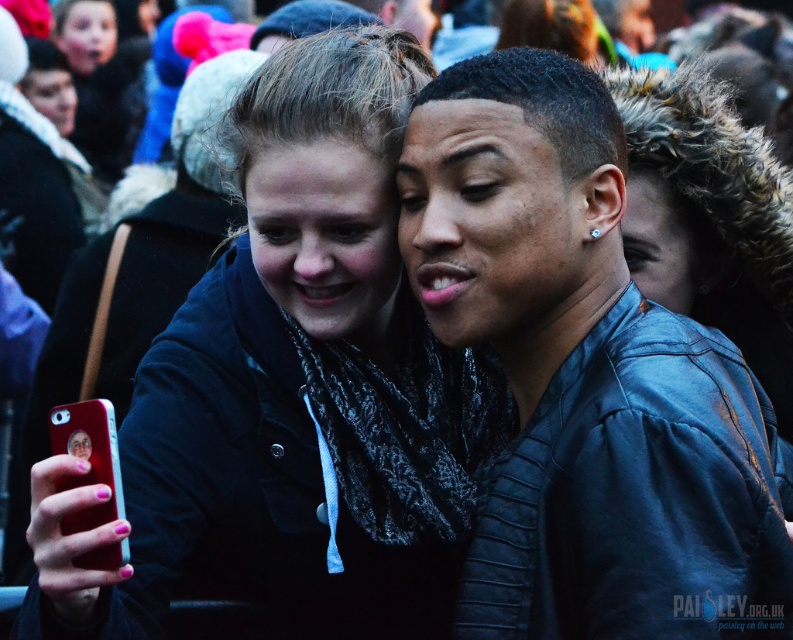
Between leather jacket at center and metallic red phone at lower left, which one appears on the left side from the viewer's perspective?

From the viewer's perspective, metallic red phone at lower left appears more on the left side.

Can you confirm if leather jacket at center is taller than metallic red phone at lower left?

Correct, leather jacket at center is much taller as metallic red phone at lower left.

The width and height of the screenshot is (793, 640). What are the coordinates of `leather jacket at center` in the screenshot? It's located at (585, 376).

Who is positioned more to the right, matte black jacket at center or metallic red phone at lower left?

matte black jacket at center is more to the right.

Can you confirm if matte black jacket at center is wider than metallic red phone at lower left?

Correct, the width of matte black jacket at center exceeds that of metallic red phone at lower left.

The image size is (793, 640). What do you see at coordinates (290, 364) in the screenshot?
I see `matte black jacket at center` at bounding box center [290, 364].

Find the location of `matte black jacket at center`. matte black jacket at center is located at coordinates (290, 364).

Between point (515, 609) and point (414, 433), which one is positioned in front?

Point (515, 609)

How much distance is there between leather jacket at center and matte black jacket at center?

4.92 feet

Does point (497, 140) lie in front of point (274, 342)?

Yes, point (497, 140) is in front of point (274, 342).

This screenshot has width=793, height=640. Find the location of `leather jacket at center`. leather jacket at center is located at coordinates (585, 376).